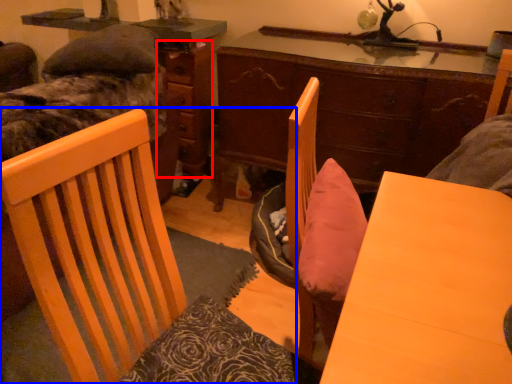
Question: Which object is further to the camera taking this photo, dresser (highlighted by a red box) or chair (highlighted by a blue box)?

Choices:
 (A) dresser
 (B) chair

Answer: (A)